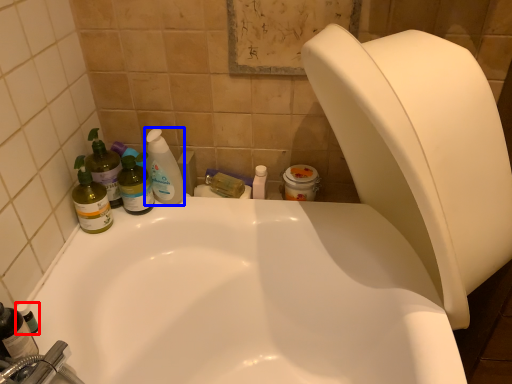
Question: Which object is closer to the camera taking this photo, toiletry (highlighted by a red box) or cleaning product (highlighted by a blue box)?

Choices:
 (A) toiletry
 (B) cleaning product

Answer: (A)